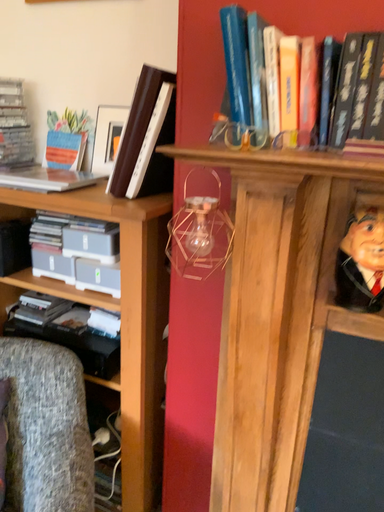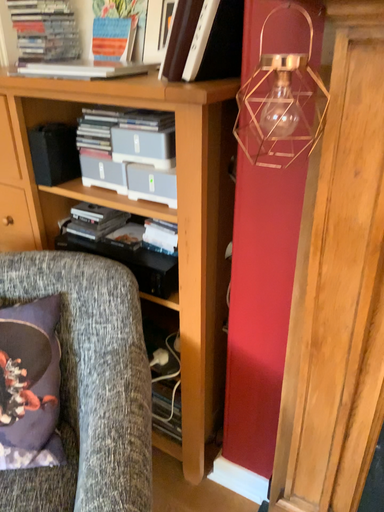
Question: How did the camera likely rotate when shooting the video?

Choices:
 (A) rotated left
 (B) rotated right

Answer: (A)